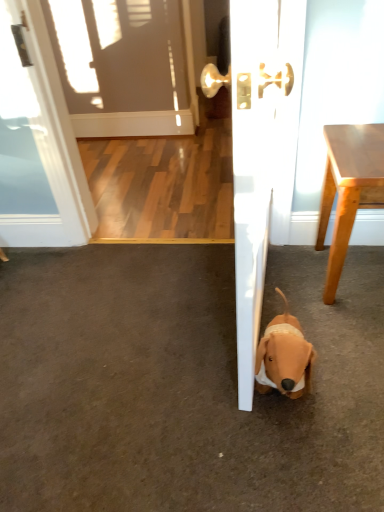
Question: From the image's perspective, relative to white glossy door at center, is brown plush dog at lower right above or below?

Choices:
 (A) above
 (B) below

Answer: (B)

Question: Considering the positions of point (152, 466) and point (289, 101), is point (152, 466) closer or farther from the camera than point (289, 101)?

Choices:
 (A) closer
 (B) farther

Answer: (A)

Question: Based on their relative distances, which object is farther from the soft plush dog at lower center?

Choices:
 (A) brown plush dog at lower right
 (B) light brown wood table at right
 (C) white glossy door at center

Answer: (C)

Question: Which of these objects is positioned closest to the soft plush dog at lower center?

Choices:
 (A) brown plush dog at lower right
 (B) light brown wood table at right
 (C) white glossy door at center

Answer: (A)